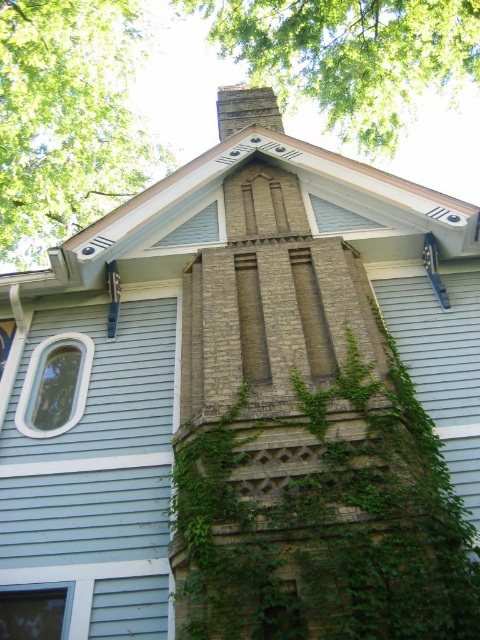
You are a window cleaner standing at the base of the green leafy tree at upper left and the brown brick chimney at upper center. Your ladder can extend up to 4 meters. Can you reach both objects with your ladder without moving it?

The green leafy tree at upper left and brown brick chimney at upper center are 4.37 meters apart. Since your ladder can only extend up to 4 meters, you cannot reach both objects without moving the ladder because the distance between them exceeds the ladder length.

From the picture: You are a window installer assessing the house. You need to replace both the white plastic window at upper left and the clear glass window at lower left. Based on their sizes, which window will require a larger replacement pane?

The white plastic window at upper left requires a larger replacement pane because it is taller than the clear glass window at lower left.